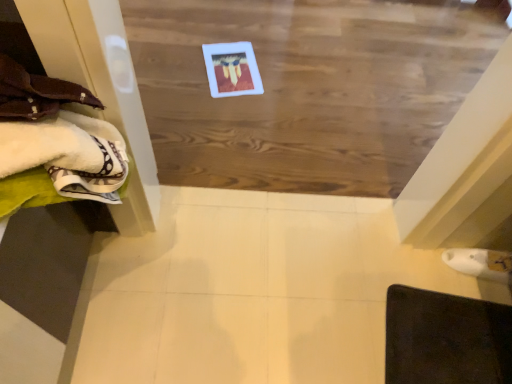
Question: Considering the positions of wooden board at center and dark brown leather mat at lower right in the image, is wooden board at center bigger or smaller than dark brown leather mat at lower right?

Choices:
 (A) big
 (B) small

Answer: (A)

Question: In terms of width, does wooden board at center look wider or thinner when compared to dark brown leather mat at lower right?

Choices:
 (A) thin
 (B) wide

Answer: (B)

Question: Estimate the real-world distances between objects in this image. Which object is farther from the white soft towels at left?

Choices:
 (A) dark brown leather mat at lower right
 (B) wooden board at center

Answer: (A)

Question: Considering the real-world distances, which object is farthest from the white soft towels at left?

Choices:
 (A) wooden board at center
 (B) dark brown leather mat at lower right

Answer: (B)